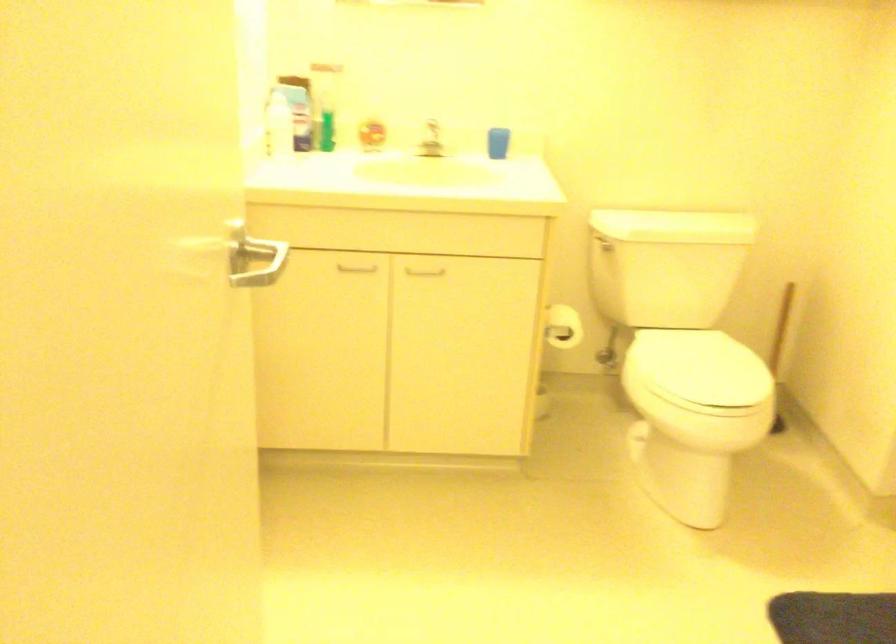
Find the location of `toilet paper roll`. toilet paper roll is located at coordinates (563, 327).